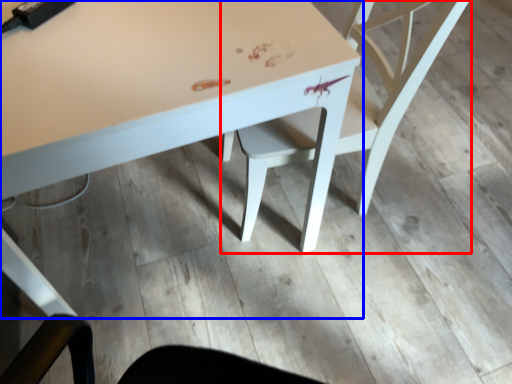
Question: Which object appears closest to the camera in this image, chair (highlighted by a red box) or table (highlighted by a blue box)?

Choices:
 (A) chair
 (B) table

Answer: (B)